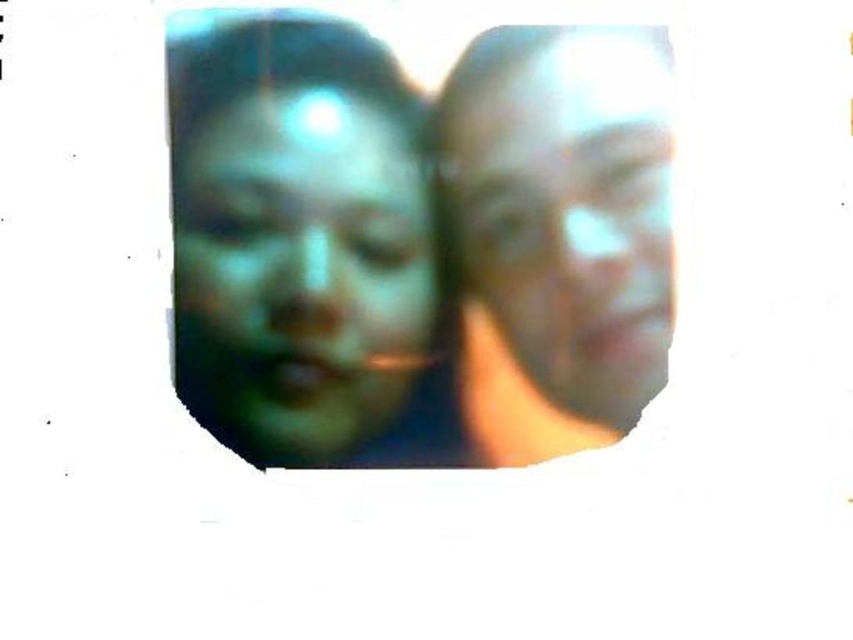
You are standing at the origin point of the image. You see two points, point (294, 260) and point (566, 397). Which point is closer to you?

Point (294, 260) is in front of point (566, 397), so it is closer to you.

You are a photographer trying to determine if two people in the image can be captured clearly in a new photo. Given that your camera has a minimum focus distance of 7 inches between subjects, will the green matte face at center and the smooth skin face at right be in focus?

The green matte face at center and the smooth skin face at right are 7.16 inches apart, which is just above the camera minimum focus distance of 7 inches. Therefore, the camera can capture both faces in focus.

You are a photographer standing 1.2 meters away from the green matte face at center in the image. Can you adjust your position to be closer to the face without moving the subject? Please explain.

The green matte face at center and the viewer are currently 1.06 meters apart. Since you are standing 1.2 meters away, you need to move 0.14 meters closer to the face to match the described distance. This adjustment would allow you to be within the specified proximity without moving the subject.